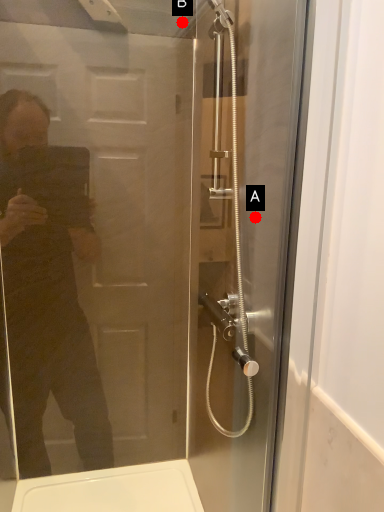
Question: Two points are circled on the image, labeled by A and B beside each circle. Which point is farther to the camera?

Choices:
 (A) A is further
 (B) B is further

Answer: (B)